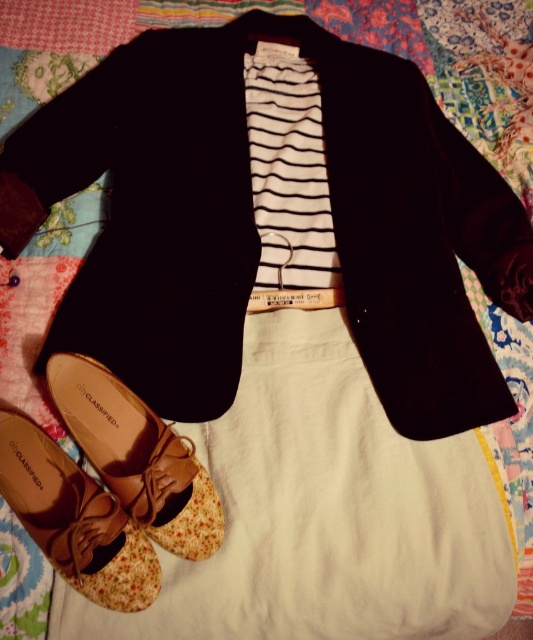
Looking at this image, you are a fashion designer trying to pack the black cotton jacket at center and the brown leather shoe at lower left into a box. The box can only fit items that are smaller than the jacket. Can both items fit in the box?

The black cotton jacket at center is bigger than the brown leather shoe at lower left. Since the box can only fit items smaller than the jacket, the shoe can fit, but the jacket cannot. Therefore, only the brown leather shoe at lower left can be placed in the box.

You are a fashion designer examining an outfit layout on a patterned fabric. You notice two points marked on the image. The first point is at coordinates point [372,346] and the second is at point [70,541]. Which of these two points is closer to you as you look at the image?

Point [372,346] is closer to you than point [70,541] because it is further to the viewer according to the description.

You are a fashion designer trying to arrange the outfit on a display. You have two brown shoes at the lower left corner. How far apart are the brown leather shoe at lower left and the brown fabric shoe at lower left?

The distance between the brown leather shoe at lower left and the brown fabric shoe at lower left is 2.42 inches.